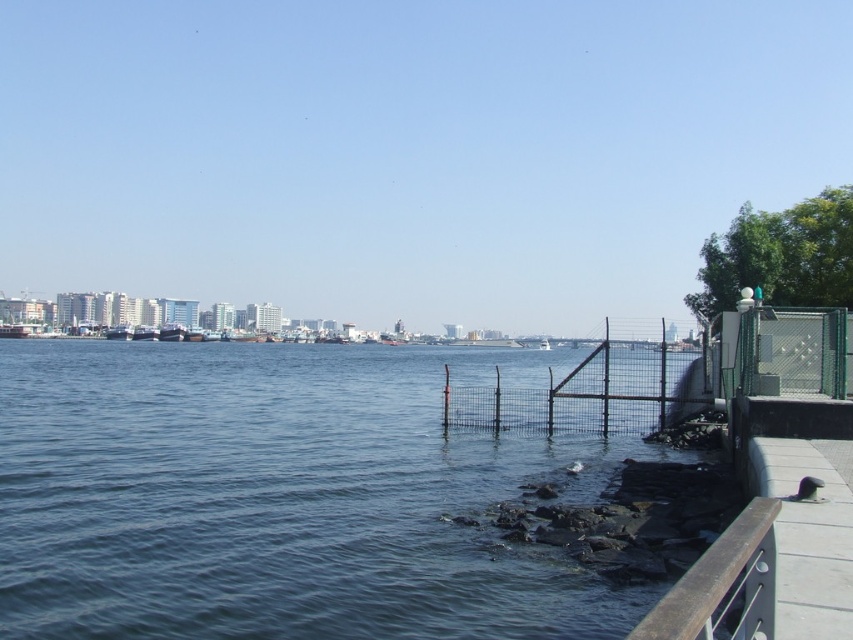
Question: Can you confirm if blue water at lower left is positioned below brown wooden rail at lower right?

Choices:
 (A) yes
 (B) no

Answer: (A)

Question: Based on their relative distances, which object is farther from the brown wooden rail at lower right?

Choices:
 (A) black wire fence at center
 (B) blue water at lower left

Answer: (B)

Question: Does blue water at lower left have a greater width compared to black wire fence at center?

Choices:
 (A) no
 (B) yes

Answer: (B)

Question: Which of the following is the closest to the observer?

Choices:
 (A) brown wooden rail at lower right
 (B) black wire fence at center
 (C) blue water at lower left

Answer: (A)

Question: Which object appears closest to the camera in this image?

Choices:
 (A) black wire fence at center
 (B) blue water at lower left

Answer: (B)

Question: Is the position of black wire fence at center more distant than that of brown wooden rail at lower right?

Choices:
 (A) yes
 (B) no

Answer: (A)